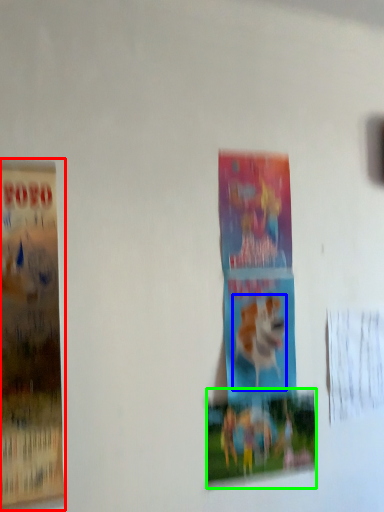
Question: Estimate the real-world distances between objects in this image. Which object is closer to poster (highlighted by a red box), animal (highlighted by a blue box) or poster (highlighted by a green box)?

Choices:
 (A) animal
 (B) poster

Answer: (B)